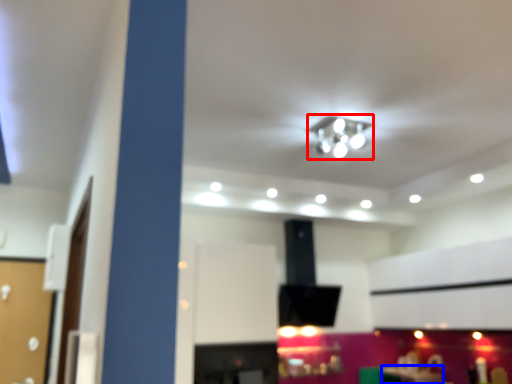
Question: Among these objects, which one is nearest to the camera, lamp (highlighted by a red box) or table (highlighted by a blue box)?

Choices:
 (A) lamp
 (B) table

Answer: (A)